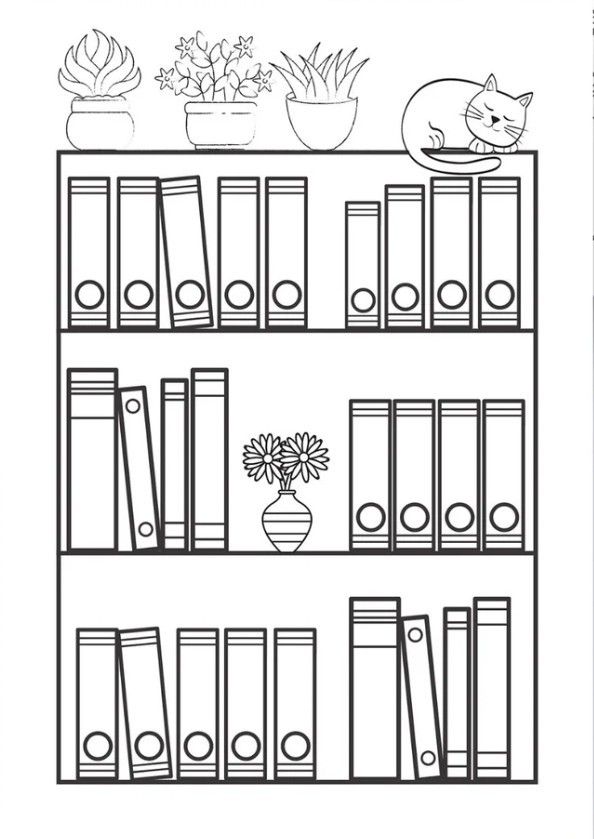
Find the location of a particular element. shelves is located at coordinates (63, 733), (60, 539), (61, 315), (64, 144).